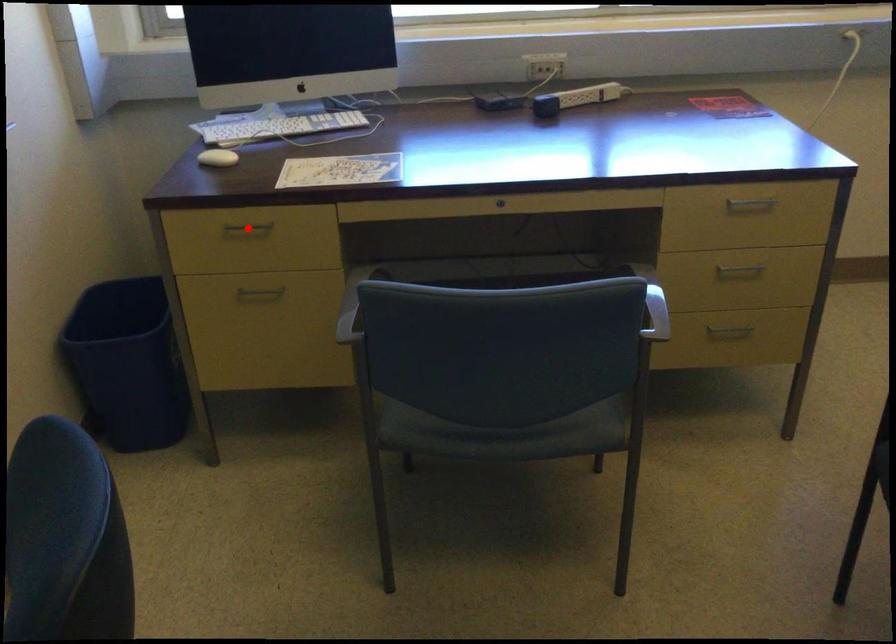
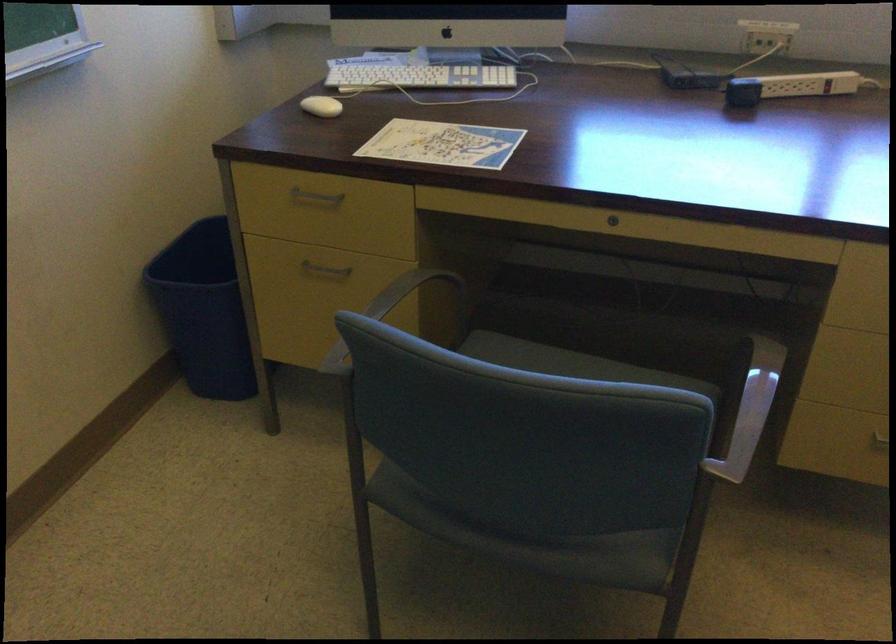
Question: I am providing you with two images of the same scene from different viewpoints. Image1 has a red point marked. In image2, the corresponding 3D location appears at what relative position? Reply with the corresponding letter.

Choices:
 (A) Closer
 (B) Farther

Answer: (A)